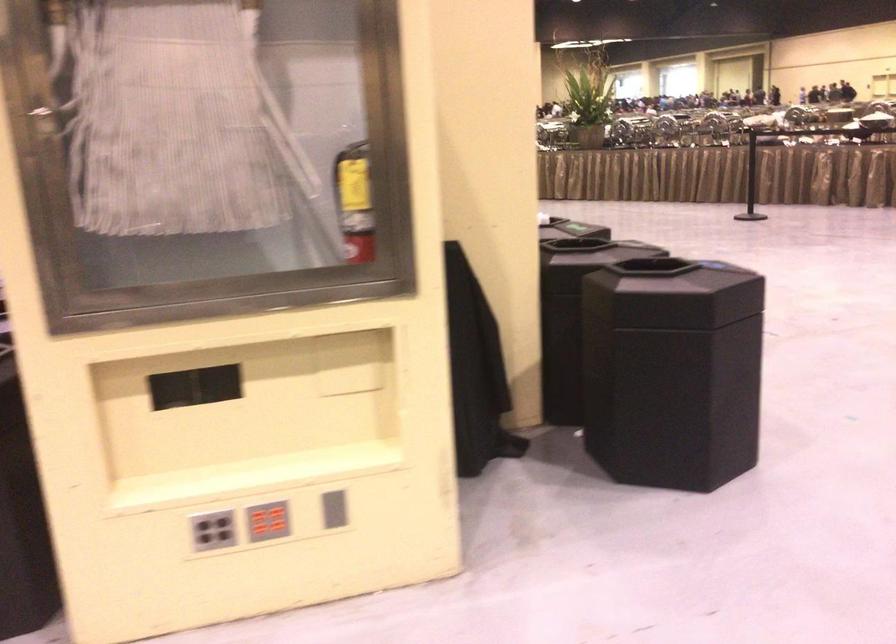
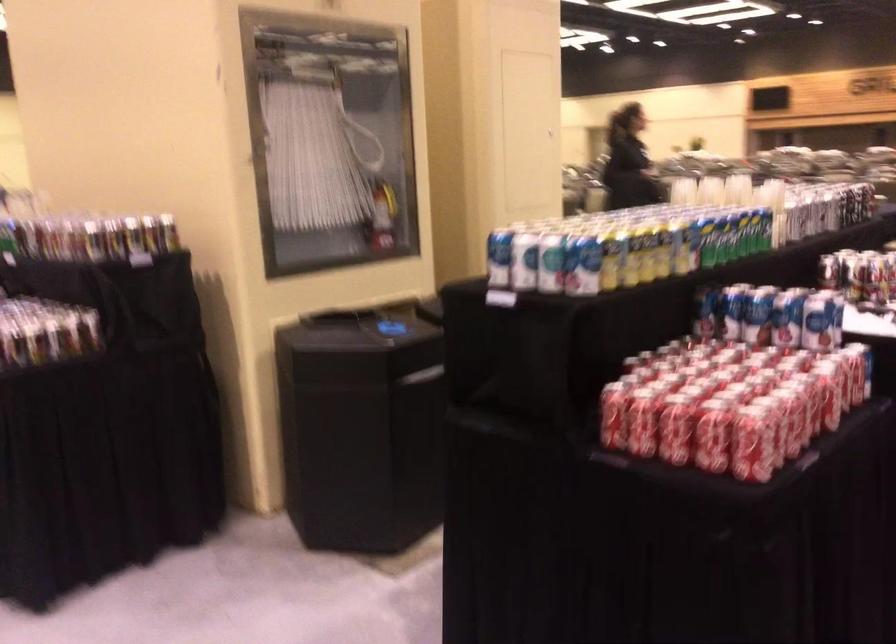
Question: I am providing you with two images of the same scene from different viewpoints. Please identify which objects are invisible in image2.

Choices:
 (A) red button panel
 (B) green and yellow can
 (C) red soda can
 (D) green scissors

Answer: (A)